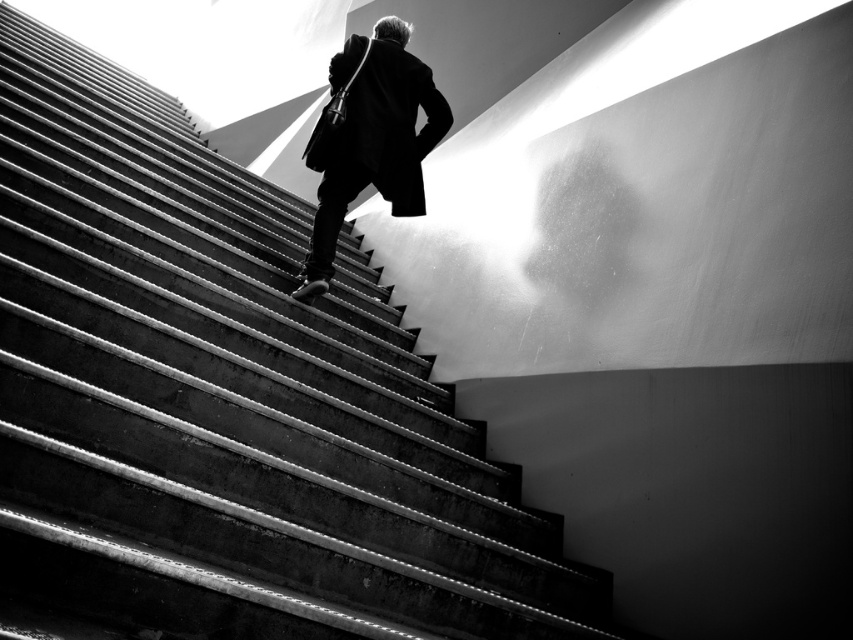
Question: Which point is closer to the camera?

Choices:
 (A) black matte coat at center
 (B) concrete stairs at center

Answer: (B)

Question: In this image, where is concrete stairs at center located relative to black matte coat at center?

Choices:
 (A) below
 (B) above

Answer: (A)

Question: Is concrete stairs at center further to the viewer compared to black matte coat at center?

Choices:
 (A) no
 (B) yes

Answer: (A)

Question: Can you confirm if concrete stairs at center is thinner than black matte coat at center?

Choices:
 (A) yes
 (B) no

Answer: (B)

Question: Which point is farther to the camera?

Choices:
 (A) black matte coat at center
 (B) concrete stairs at center

Answer: (A)